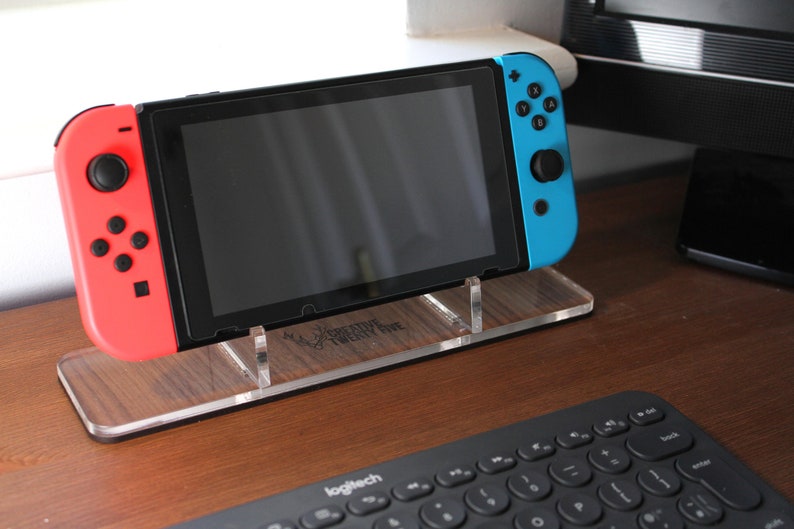
Locate an element on the screen. The image size is (794, 529). wood table is located at coordinates (671, 327).